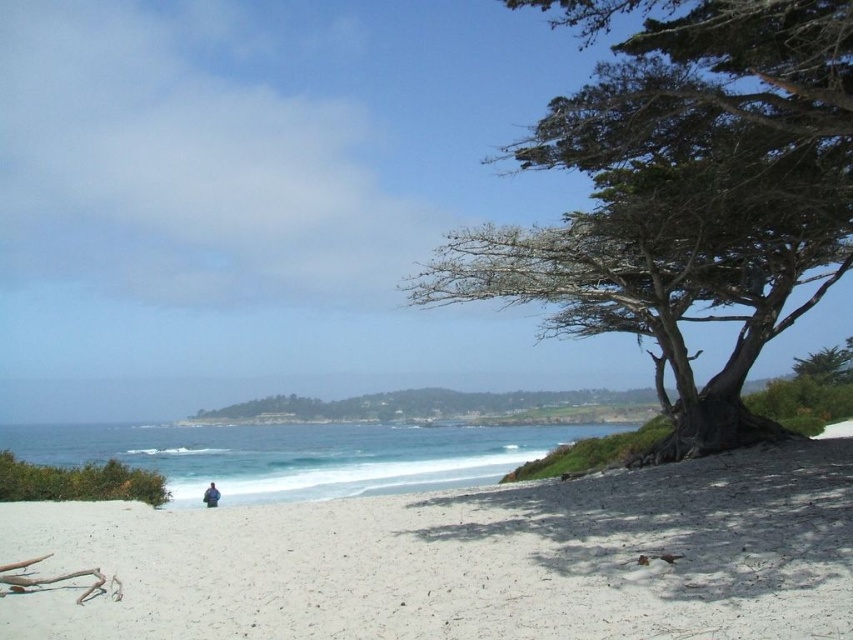
Question: Does white sand at lower center have a smaller size compared to green leafy bush at lower left?

Choices:
 (A) no
 (B) yes

Answer: (B)

Question: Which of the following is the farthest from the observer?

Choices:
 (A) purple fabric person at lower center
 (B) white sand at lower center
 (C) green textured tree at upper right
 (D) green leafy bush at lower left

Answer: (A)

Question: Is white sand at lower center wider than purple fabric person at lower center?

Choices:
 (A) no
 (B) yes

Answer: (B)

Question: Which object is closer to the camera taking this photo?

Choices:
 (A) white sand at lower center
 (B) purple fabric person at lower center

Answer: (A)

Question: Which object is closer to the camera taking this photo?

Choices:
 (A) green leafy bush at lower left
 (B) white sand at lower center

Answer: (B)

Question: Is white sand at lower center behind green textured tree at upper right?

Choices:
 (A) no
 (B) yes

Answer: (A)